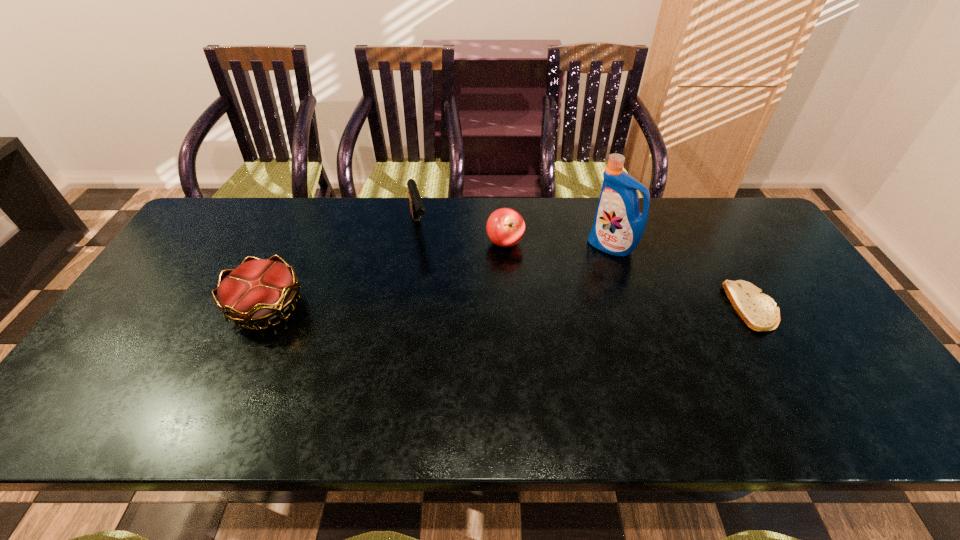
Locate an element on the screen. This screenshot has width=960, height=540. vacant space that is in between the crown and the shortest object is located at coordinates (510, 307).

This screenshot has width=960, height=540. I want to click on free spot between the leftmost object and the second object from left to right, so click(343, 267).

At what (x,y) coordinates should I click in order to perform the action: click on free point between the shortest object and the apple. Please return your answer as a coordinate pair (x, y). The height and width of the screenshot is (540, 960). Looking at the image, I should click on (629, 275).

At what (x,y) coordinates should I click in order to perform the action: click on vacant area between the shortest object and the crown. Please return your answer as a coordinate pair (x, y). This screenshot has height=540, width=960. Looking at the image, I should click on (510, 307).

At what (x,y) coordinates should I click in order to perform the action: click on free space between the leftmost object and the tallest object. Please return your answer as a coordinate pair (x, y). The image size is (960, 540). Looking at the image, I should click on (439, 277).

Find the location of a particular element. Image resolution: width=960 pixels, height=540 pixels. free area in between the fourth shortest object and the pita bread is located at coordinates (587, 267).

What are the coordinates of `free spot between the crown and the detergent` in the screenshot? It's located at pyautogui.click(x=439, y=277).

Locate an element on the screen. The width and height of the screenshot is (960, 540). object that stands as the third closest to the pita bread is located at coordinates (417, 208).

Locate an element on the screen. Image resolution: width=960 pixels, height=540 pixels. the closest object to the pita bread is located at coordinates (618, 227).